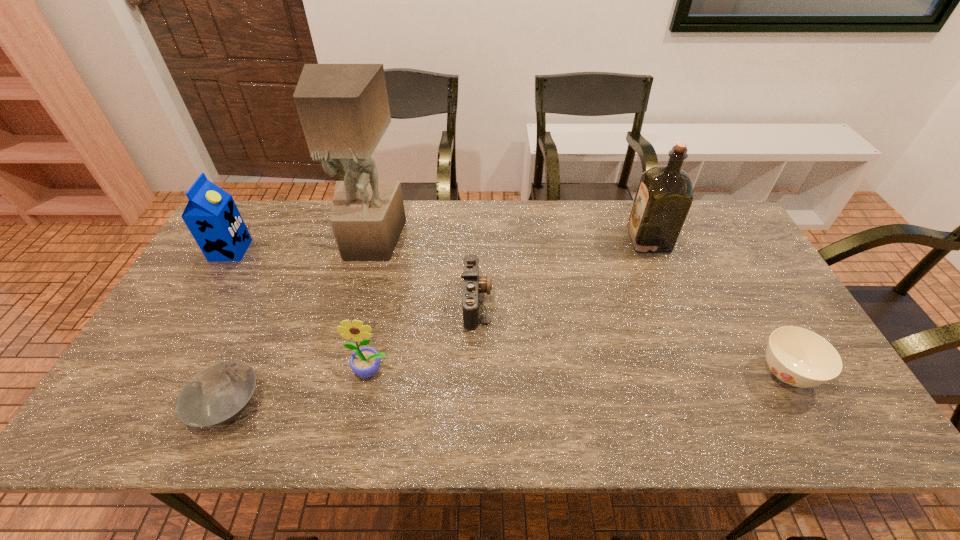
You are a GUI agent. You are given a task and a screenshot of the screen. Output one action in this format:
    pyautogui.click(x=<x>, y=<y>)
    Task: Click on the vacant space in between the second tallest object and the shortest object
    
    Given the screenshot: What is the action you would take?
    pyautogui.click(x=438, y=322)

Locate an element on the screen. The width and height of the screenshot is (960, 540). vacant area that lies between the sunflower and the sculpture is located at coordinates (372, 306).

Identify the location of empty space that is in between the camera and the tallest object. This screenshot has height=540, width=960. (424, 271).

Identify which object is located as the nearest to the fourth tallest object. Please provide its 2D coordinates. Your answer should be formatted as a tuple, i.e. [(x, y)], where the tuple contains the x and y coordinates of a point satisfying the conditions above.

[(219, 393)]

Find the location of a particular element. The image size is (960, 540). the third closest object to the camera is located at coordinates (664, 196).

Locate an element on the screen. vacant area in the image that satisfies the following two spatial constraints: 1. on the front-facing side of the camera; 2. on the front-facing side of the sunflower is located at coordinates (476, 370).

The width and height of the screenshot is (960, 540). Find the location of `blank area in the image that satisfies the following two spatial constraints: 1. on the back side of the sugar bowl; 2. on the front-facing side of the camera`. blank area in the image that satisfies the following two spatial constraints: 1. on the back side of the sugar bowl; 2. on the front-facing side of the camera is located at coordinates (746, 301).